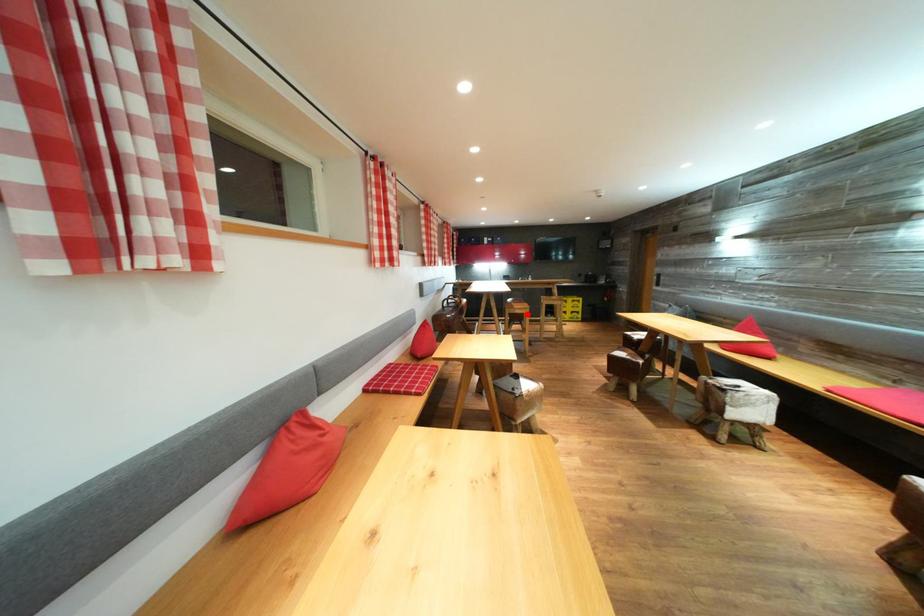
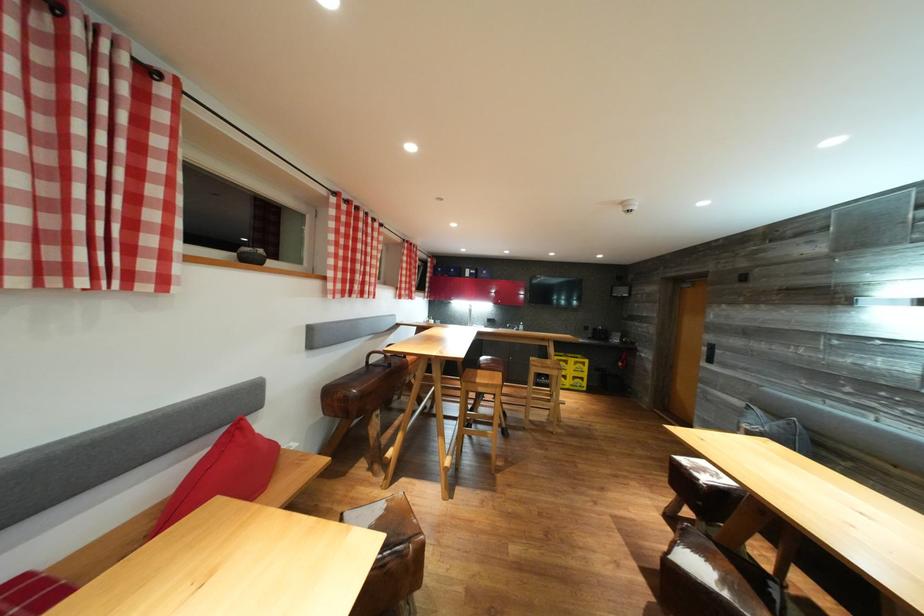
Where in the second image is the point corresponding to the highlighted location from the first image?

(492, 391)